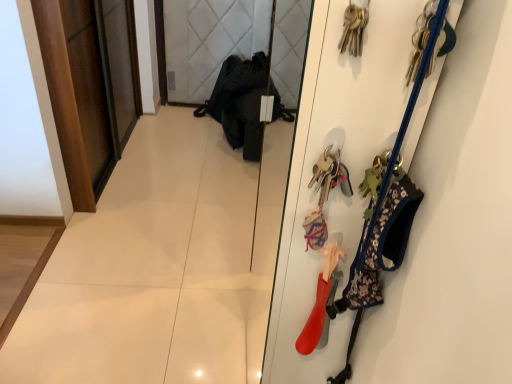
What is the approximate width of clear glass mirror at center?

clear glass mirror at center is 1.22 inches in width.

What do you see at coordinates (421, 38) in the screenshot? The image size is (512, 384). I see `metallic keys at upper right, positioned as the 1th accessory in top-to-bottom order` at bounding box center [421, 38].

The height and width of the screenshot is (384, 512). What are the coordinates of `rubberized red boot at right, the 3th accessory positioned from the top` in the screenshot? It's located at (320, 299).

Where is `dark wood door at left`? dark wood door at left is located at coordinates (77, 95).

Considering the points (442, 28) and (356, 287), which point is in front, point (442, 28) or point (356, 287)?

The point (442, 28) is in front.

Is floral fabric dog harness at right, which appears as the 2th accessory when viewed from the top, a part of metallic keys at upper right, positioned as the 1th accessory in top-to-bottom order?

→ No, floral fabric dog harness at right, which appears as the 2th accessory when viewed from the top, is not inside metallic keys at upper right, positioned as the 1th accessory in top-to-bottom order.

Considering the sizes of objects metallic keys at upper right, the third accessory from the bottom, and floral fabric dog harness at right, the 2th accessory in the bottom-to-top sequence, in the image provided, who is wider, metallic keys at upper right, the third accessory from the bottom, or floral fabric dog harness at right, the 2th accessory in the bottom-to-top sequence,?

Wider between the two is floral fabric dog harness at right, the 2th accessory in the bottom-to-top sequence.

Who is shorter, metallic keys at upper right, positioned as the 1th accessory in top-to-bottom order, or floral fabric dog harness at right, the 2th accessory in the bottom-to-top sequence?

metallic keys at upper right, positioned as the 1th accessory in top-to-bottom order.

Locate an element on the screen. mirror located below the dark wood door at left (from the image's perspective) is located at coordinates (270, 196).

Is dark wood door at left at the back of clear glass mirror at center?

No, clear glass mirror at center's orientation is not away from dark wood door at left.

In terms of width, does clear glass mirror at center look wider or thinner when compared to dark wood door at left?

Considering their sizes, clear glass mirror at center looks slimmer than dark wood door at left.

From a real-world perspective, does clear glass mirror at center stand above dark wood door at left?

Yes.

From a real-world perspective, is rubberized red boot at right, the 3th accessory positioned from the top, positioned under metallic keys at upper right, positioned as the 1th accessory in top-to-bottom order, based on gravity?

Yes, from a real-world perspective, rubberized red boot at right, the 3th accessory positioned from the top, is below metallic keys at upper right, positioned as the 1th accessory in top-to-bottom order.

Based on the photo, considering the relative sizes of rubberized red boot at right, the 3th accessory positioned from the top, and metallic keys at upper right, the third accessory from the bottom, in the image provided, is rubberized red boot at right, the 3th accessory positioned from the top, bigger than metallic keys at upper right, the third accessory from the bottom,?

Correct, rubberized red boot at right, the 3th accessory positioned from the top, is larger in size than metallic keys at upper right, the third accessory from the bottom.

Measure the distance between rubberized red boot at right, the 3th accessory positioned from the top, and metallic keys at upper right, the third accessory from the bottom.

rubberized red boot at right, the 3th accessory positioned from the top, is 15.52 inches away from metallic keys at upper right, the third accessory from the bottom.

Considering the points (317, 293) and (445, 41), which point is behind, point (317, 293) or point (445, 41)?

The point (317, 293) is behind.

Looking at this image, which object is further away from the camera taking this photo, clear glass mirror at center or floral fabric dog harness at right, the 2th accessory in the bottom-to-top sequence?

clear glass mirror at center is behind.

How many degrees apart are the facing directions of clear glass mirror at center and floral fabric dog harness at right, which appears as the 2th accessory when viewed from the top?

The angular difference between clear glass mirror at center and floral fabric dog harness at right, which appears as the 2th accessory when viewed from the top, is 99.3 degrees.

Would you say clear glass mirror at center is inside or outside floral fabric dog harness at right, which appears as the 2th accessory when viewed from the top?

clear glass mirror at center is not inside floral fabric dog harness at right, which appears as the 2th accessory when viewed from the top, it's outside.

Considering the sizes of objects clear glass mirror at center and floral fabric dog harness at right, the 2th accessory in the bottom-to-top sequence, in the image provided, who is bigger, clear glass mirror at center or floral fabric dog harness at right, the 2th accessory in the bottom-to-top sequence,?

Bigger between the two is clear glass mirror at center.

Considering the positions of point (426, 42) and point (291, 91), is point (426, 42) closer or farther from the camera than point (291, 91)?

Point (426, 42) is positioned closer to the camera compared to point (291, 91).

Is clear glass mirror at center surrounded by metallic keys at upper right, the third accessory from the bottom?

No.

Does metallic keys at upper right, the third accessory from the bottom, have a larger size compared to clear glass mirror at center?

Incorrect, metallic keys at upper right, the third accessory from the bottom, is not larger than clear glass mirror at center.

From the image's perspective, between dark wood door at left and metallic keys at upper right, the third accessory from the bottom, which one is located above?

From the image's view, dark wood door at left is above.

Considering the sizes of objects dark wood door at left and metallic keys at upper right, the third accessory from the bottom, in the image provided, who is smaller, dark wood door at left or metallic keys at upper right, the third accessory from the bottom,?

Smaller between the two is metallic keys at upper right, the third accessory from the bottom.

Is dark wood door at left outside of metallic keys at upper right, the third accessory from the bottom?

That's correct, dark wood door at left is outside of metallic keys at upper right, the third accessory from the bottom.

Considering the sizes of dark wood door at left and metallic keys at upper right, the third accessory from the bottom, in the image, is dark wood door at left wider or thinner than metallic keys at upper right, the third accessory from the bottom,?

In the image, dark wood door at left appears to be wider than metallic keys at upper right, the third accessory from the bottom.

From a real-world perspective, is dark wood door at left located beneath floral fabric dog harness at right, the 2th accessory in the bottom-to-top sequence?

Correct, in the physical world, dark wood door at left is lower than floral fabric dog harness at right, the 2th accessory in the bottom-to-top sequence.

Can you confirm if dark wood door at left is taller than floral fabric dog harness at right, which appears as the 2th accessory when viewed from the top?

Indeed, dark wood door at left has a greater height compared to floral fabric dog harness at right, which appears as the 2th accessory when viewed from the top.

Is dark wood door at left completely or partially outside of floral fabric dog harness at right, the 2th accessory in the bottom-to-top sequence?

dark wood door at left lies outside floral fabric dog harness at right, the 2th accessory in the bottom-to-top sequence,'s area.

Can you tell me how much dark wood door at left and floral fabric dog harness at right, the 2th accessory in the bottom-to-top sequence, differ in facing direction?

dark wood door at left and floral fabric dog harness at right, the 2th accessory in the bottom-to-top sequence, are facing 90.7 degrees away from each other.

Find the location of a particular element. The width and height of the screenshot is (512, 384). accessory that is above the floral fabric dog harness at right, which appears as the 2th accessory when viewed from the top (from the image's perspective) is located at coordinates (421, 38).

In the image, there is a clear glass mirror at center. Where is `door below it (from a real-world perspective)`? The width and height of the screenshot is (512, 384). door below it (from a real-world perspective) is located at coordinates (77, 95).

From the image, which object appears to be nearer to rubberized red boot at right, the 3th accessory positioned from the top, clear glass mirror at center or floral fabric dog harness at right, which appears as the 2th accessory when viewed from the top?

floral fabric dog harness at right, which appears as the 2th accessory when viewed from the top.

When comparing their distances from metallic keys at upper right, positioned as the 1th accessory in top-to-bottom order, does dark wood door at left or clear glass mirror at center seem further?

The object further to metallic keys at upper right, positioned as the 1th accessory in top-to-bottom order, is clear glass mirror at center.

From the image, which object appears to be nearer to rubberized red boot at right, the first accessory positioned from the bottom, dark wood door at left or metallic keys at upper right, the third accessory from the bottom?

→ Based on the image, metallic keys at upper right, the third accessory from the bottom, appears to be nearer to rubberized red boot at right, the first accessory positioned from the bottom.

Considering their positions, is dark wood door at left positioned further to floral fabric dog harness at right, which appears as the 2th accessory when viewed from the top, than metallic keys at upper right, positioned as the 1th accessory in top-to-bottom order?

Among the two, dark wood door at left is located further to floral fabric dog harness at right, which appears as the 2th accessory when viewed from the top.

From the image, which object appears to be nearer to metallic keys at upper right, positioned as the 1th accessory in top-to-bottom order, floral fabric dog harness at right, which appears as the 2th accessory when viewed from the top, or rubberized red boot at right, the 3th accessory positioned from the top?

Based on the image, floral fabric dog harness at right, which appears as the 2th accessory when viewed from the top, appears to be nearer to metallic keys at upper right, positioned as the 1th accessory in top-to-bottom order.

Based on their spatial positions, is clear glass mirror at center or metallic keys at upper right, the third accessory from the bottom, further from floral fabric dog harness at right, the 2th accessory in the bottom-to-top sequence?

The object further to floral fabric dog harness at right, the 2th accessory in the bottom-to-top sequence, is clear glass mirror at center.

Which object lies further to the anchor point clear glass mirror at center, rubberized red boot at right, the 3th accessory positioned from the top, or dark wood door at left?

Among the two, rubberized red boot at right, the 3th accessory positioned from the top, is located further to clear glass mirror at center.

Which object lies nearer to the anchor point metallic keys at upper right, positioned as the 1th accessory in top-to-bottom order, floral fabric dog harness at right, the 2th accessory in the bottom-to-top sequence, or dark wood door at left?

floral fabric dog harness at right, the 2th accessory in the bottom-to-top sequence, is closer to metallic keys at upper right, positioned as the 1th accessory in top-to-bottom order.

What are the coordinates of `accessory located between floral fabric dog harness at right, the 2th accessory in the bottom-to-top sequence, and clear glass mirror at center in the depth direction` in the screenshot? It's located at (320, 299).

The height and width of the screenshot is (384, 512). Identify the location of accessory between metallic keys at upper right, positioned as the 1th accessory in top-to-bottom order, and rubberized red boot at right, the 3th accessory positioned from the top, from top to bottom. (386, 212).

Where is `mirror located between floral fabric dog harness at right, the 2th accessory in the bottom-to-top sequence, and dark wood door at left in the depth direction`? The width and height of the screenshot is (512, 384). mirror located between floral fabric dog harness at right, the 2th accessory in the bottom-to-top sequence, and dark wood door at left in the depth direction is located at coordinates (270, 196).

This screenshot has height=384, width=512. Identify the location of mirror between metallic keys at upper right, the third accessory from the bottom, and dark wood door at left in the front-back direction. (270, 196).